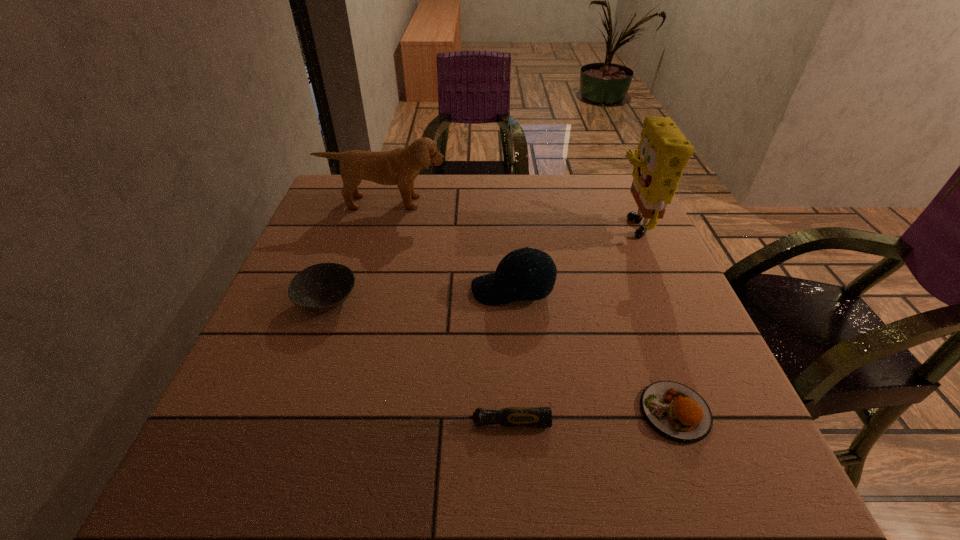
This screenshot has height=540, width=960. I want to click on puppy situated at the left edge, so click(x=400, y=166).

Identify the location of bowl that is positioned at the left edge. This screenshot has width=960, height=540. (321, 287).

Where is `sponge present at the right edge`? sponge present at the right edge is located at coordinates click(663, 152).

This screenshot has width=960, height=540. Find the location of `patty that is positioned at the right edge`. patty that is positioned at the right edge is located at coordinates (675, 411).

Where is `object present at the far left corner`? object present at the far left corner is located at coordinates (400, 166).

Identify the location of object located in the far right corner section of the desktop. (663, 152).

This screenshot has height=540, width=960. Identify the location of free space at the far edge of the desktop. (431, 176).

Locate an element on the screen. vacant region at the near edge of the desktop is located at coordinates (607, 487).

This screenshot has width=960, height=540. In order to click on free spot at the left edge of the desktop in this screenshot , I will do `click(314, 220)`.

In the image, there is a desktop. Find the location of `vacant space at the right edge`. vacant space at the right edge is located at coordinates (665, 376).